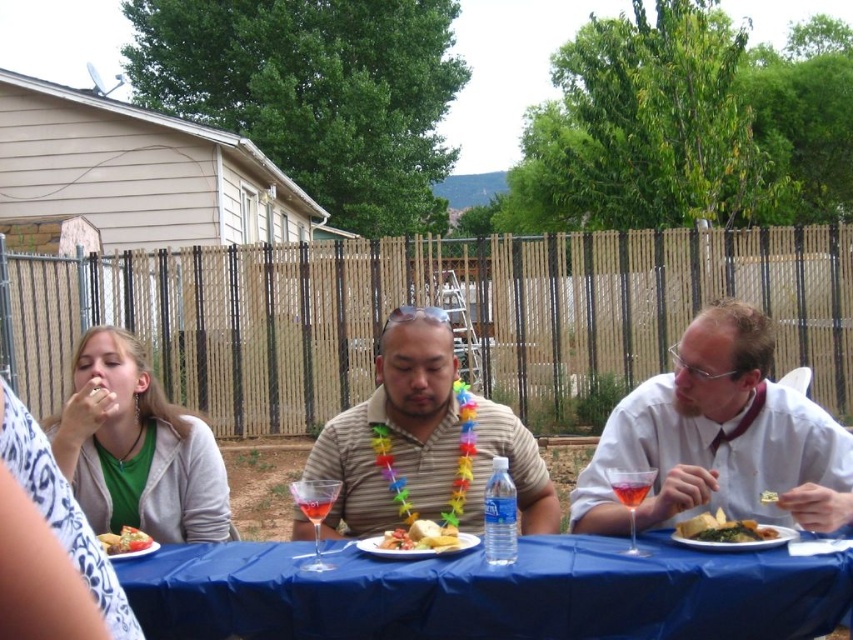
Which is in front, point (618, 484) or point (329, 499)?

Positioned in front is point (329, 499).

Between pink glass at table center and translucent glass at center, which one appears on the right side from the viewer's perspective?

pink glass at table center

Is point (645, 490) closer to camera compared to point (322, 502)?

No, (645, 490) is behind (322, 502).

The height and width of the screenshot is (640, 853). In order to click on pink glass at table center in this screenshot , I will do `click(630, 486)`.

Does striped cotton shirt at center lie in front of tomato salad at left?

No, striped cotton shirt at center is further to the viewer.

Is striped cotton shirt at center behind tomato salad at left?

Yes, striped cotton shirt at center is behind tomato salad at left.

Which is in front, point (490, 468) or point (141, 538)?

Positioned in front is point (141, 538).

The height and width of the screenshot is (640, 853). What are the coordinates of `striped cotton shirt at center` in the screenshot? It's located at (396, 429).

Can you confirm if blue fabric table at center is smaller than golden crispy bread at center?

Actually, blue fabric table at center might be larger than golden crispy bread at center.

Is blue fabric table at center taller than golden crispy bread at center?

Correct, blue fabric table at center is much taller as golden crispy bread at center.

Between point (344, 609) and point (440, 541), which one is positioned behind?

Positioned behind is point (440, 541).

Identify the location of blue fabric table at center. This screenshot has height=640, width=853. (488, 593).